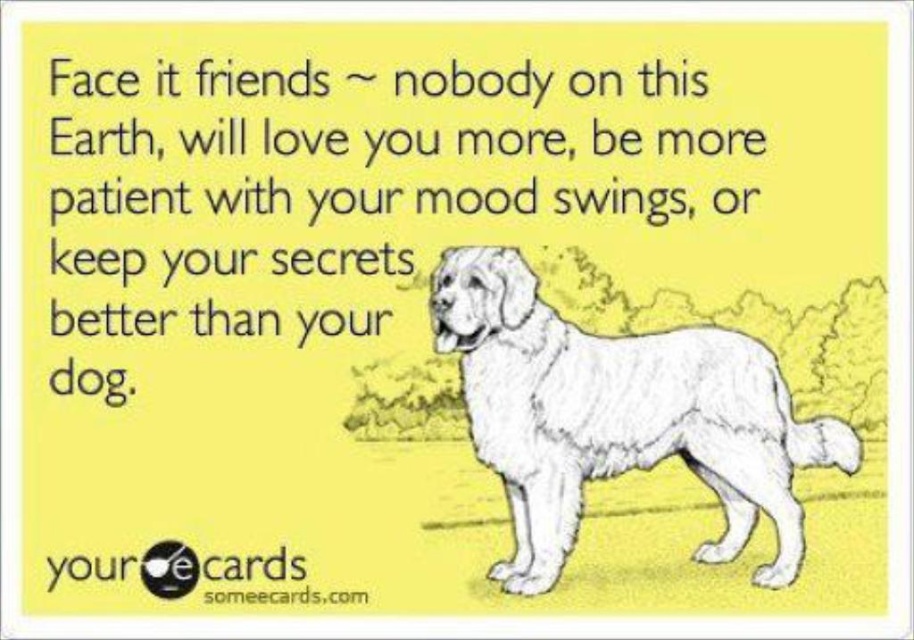
Question: Which point is farther to the camera?

Choices:
 (A) (172, 189)
 (B) (657, 429)

Answer: (B)

Question: Does white fluffy dog at right have a larger size compared to white paper at upper center?

Choices:
 (A) no
 (B) yes

Answer: (B)

Question: Is white fluffy dog at right thinner than white paper at upper center?

Choices:
 (A) yes
 (B) no

Answer: (A)

Question: Which point is farther to the camera?

Choices:
 (A) white fluffy dog at right
 (B) white paper at upper center

Answer: (A)

Question: Does white fluffy dog at right appear on the right side of white paper at upper center?

Choices:
 (A) yes
 (B) no

Answer: (A)

Question: Among these objects, which one is nearest to the camera?

Choices:
 (A) white paper at upper center
 (B) white fluffy dog at right

Answer: (A)